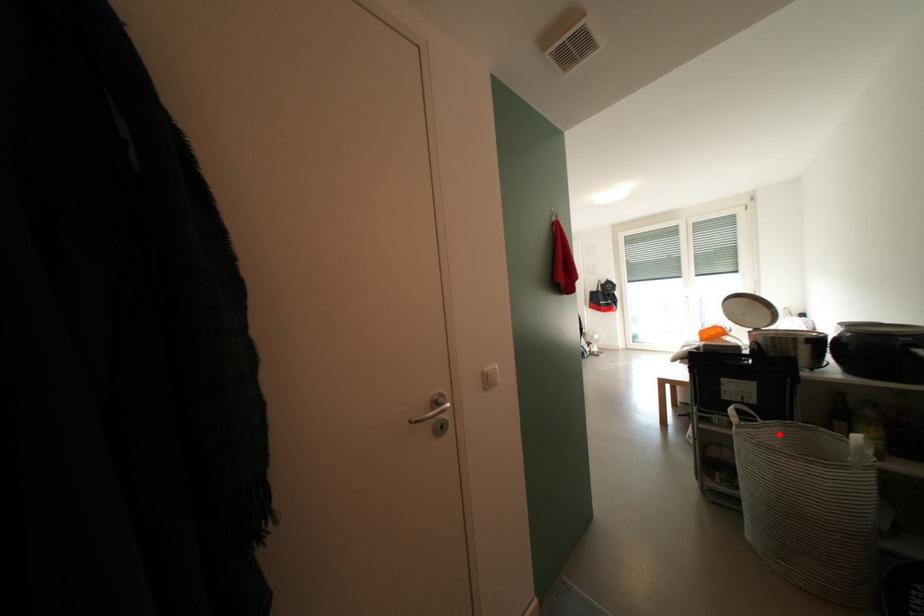
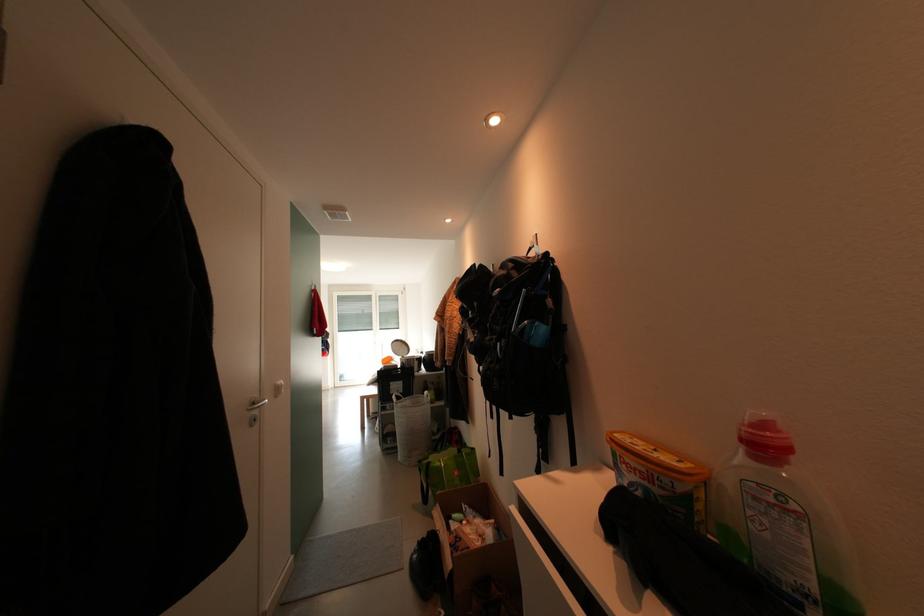
The point at the highlighted location is marked in the first image. Where is the corresponding point in the second image?

(415, 405)